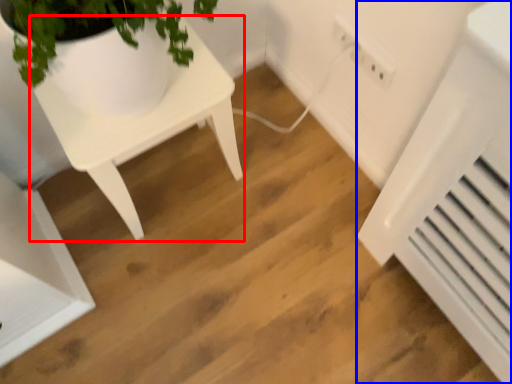
Question: Which point is further to the camera, table (highlighted by a red box) or air conditioning (highlighted by a blue box)?

Choices:
 (A) table
 (B) air conditioning

Answer: (B)